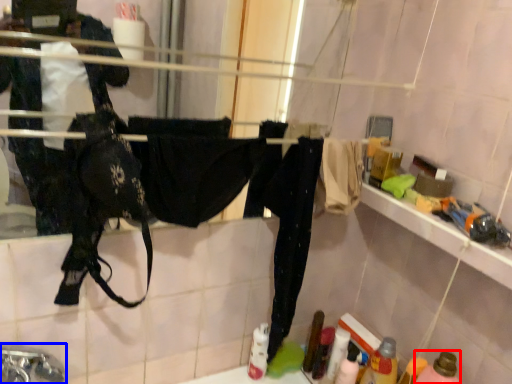
Question: Among these objects, which one is farthest to the camera, bottle (highlighted by a red box) or faucet (highlighted by a blue box)?

Choices:
 (A) bottle
 (B) faucet

Answer: (A)